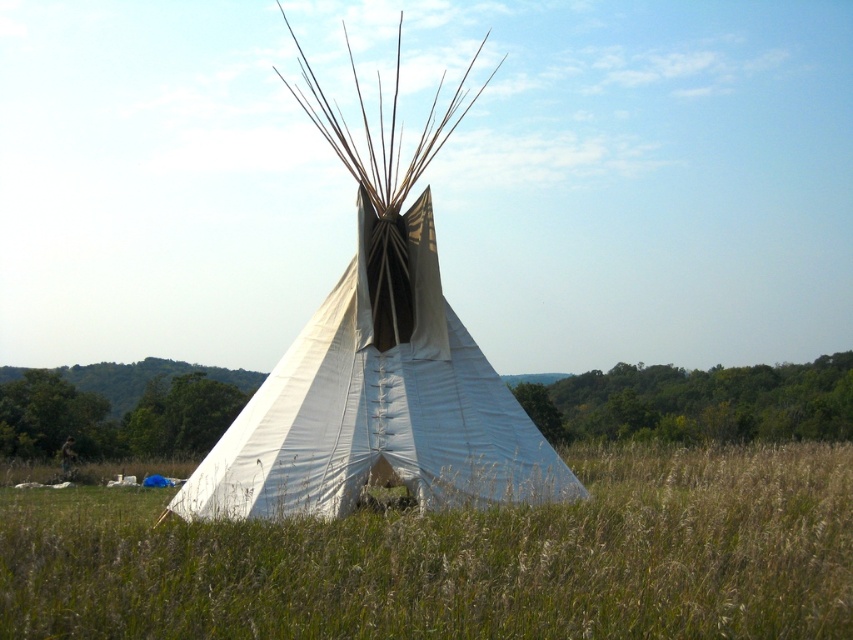
Does green grassy field at center lie behind white canvas tent at center?

No, it is not.

Between point (645, 600) and point (189, 484), which one is positioned in front?

Point (645, 600)

Between point (427, 612) and point (389, 401), which one is positioned in front?

Point (427, 612) is more forward.

Identify the location of green grassy field at center. The height and width of the screenshot is (640, 853). (459, 557).